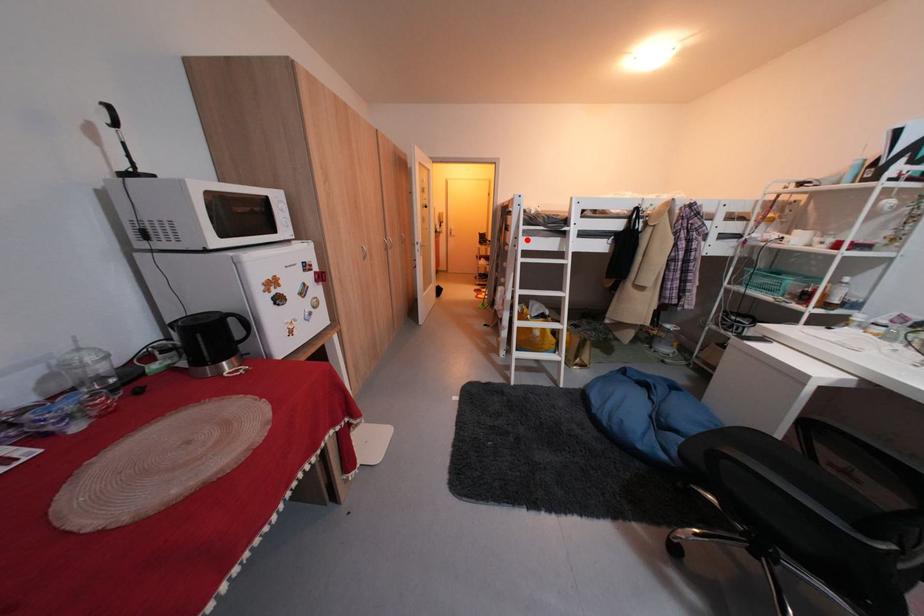
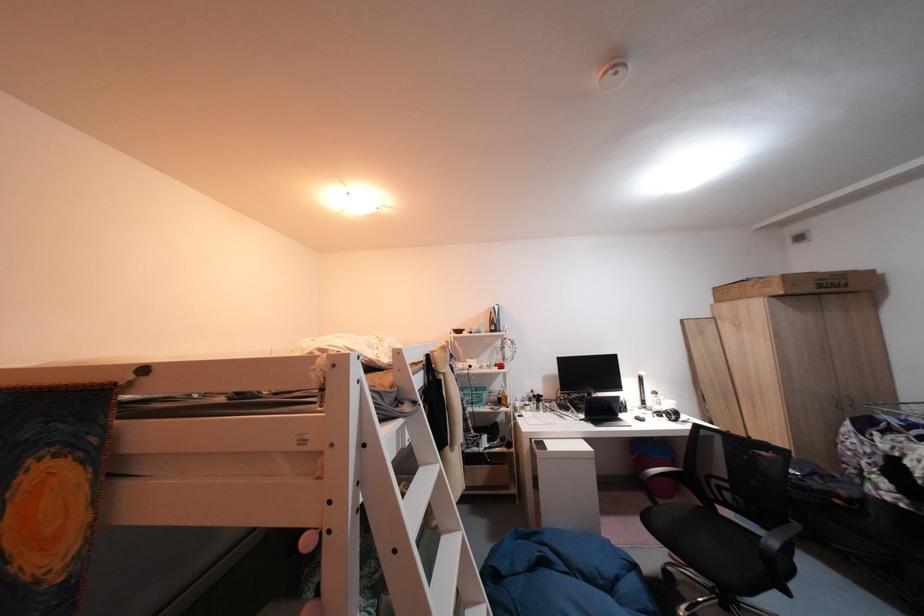
Question: I am providing you with two images of the same scene from different viewpoints. A red point is shown in image1. For the corresponding object point in image2, is it positioned nearer or farther from the camera?

Choices:
 (A) Nearer
 (B) Farther

Answer: (B)